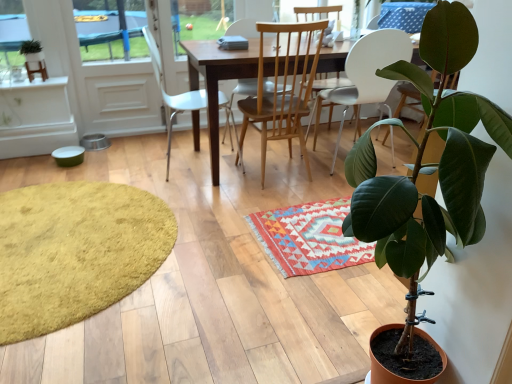
Question: Is white plastic chair at center, acting as the 3th chair starting from the right, positioned beyond the bounds of light wood/wooden chair at center, acting as the 2th chair starting from the left?

Choices:
 (A) yes
 (B) no

Answer: (A)

Question: Can you confirm if white plastic chair at center, acting as the 3th chair starting from the right, is positioned to the left of light wood/wooden chair at center, which is counted as the 2th chair, starting from the right?

Choices:
 (A) yes
 (B) no

Answer: (A)

Question: Considering the relative sizes of white plastic chair at center, acting as the 3th chair starting from the right, and light wood/wooden chair at center, acting as the 2th chair starting from the left, in the image provided, is white plastic chair at center, acting as the 3th chair starting from the right, bigger than light wood/wooden chair at center, acting as the 2th chair starting from the left,?

Choices:
 (A) yes
 (B) no

Answer: (A)

Question: Is white plastic chair at center, placed as the first chair when sorted from left to right, oriented away from light wood/wooden chair at center, acting as the 2th chair starting from the left?

Choices:
 (A) no
 (B) yes

Answer: (A)

Question: Can you confirm if white plastic chair at center, placed as the first chair when sorted from left to right, is smaller than light wood/wooden chair at center, which is counted as the 2th chair, starting from the right?

Choices:
 (A) yes
 (B) no

Answer: (B)

Question: Considering the relative sizes of white plastic chair at center, placed as the first chair when sorted from left to right, and light wood/wooden chair at center, acting as the 2th chair starting from the left, in the image provided, is white plastic chair at center, placed as the first chair when sorted from left to right, wider than light wood/wooden chair at center, acting as the 2th chair starting from the left,?

Choices:
 (A) no
 (B) yes

Answer: (A)

Question: Considering the relative sizes of white glossy screen door at upper left and green matte plant at lower right, which is counted as the 1th houseplant, starting from the right, in the image provided, is white glossy screen door at upper left smaller than green matte plant at lower right, which is counted as the 1th houseplant, starting from the right,?

Choices:
 (A) no
 (B) yes

Answer: (B)

Question: Can you confirm if white glossy screen door at upper left is positioned to the left of green matte plant at lower right, the second houseplant from the back?

Choices:
 (A) yes
 (B) no

Answer: (A)

Question: Can you confirm if white glossy screen door at upper left is shorter than green matte plant at lower right, which is counted as the 1th houseplant, starting from the right?

Choices:
 (A) yes
 (B) no

Answer: (A)

Question: Is white glossy screen door at upper left beside green matte plant at lower right, the second houseplant from the back?

Choices:
 (A) no
 (B) yes

Answer: (A)

Question: From a real-world perspective, is white glossy screen door at upper left below green matte plant at lower right, the second houseplant from the back?

Choices:
 (A) no
 (B) yes

Answer: (B)

Question: Can you confirm if white glossy screen door at upper left is bigger than green matte plant at lower right, positioned as the second houseplant in left-to-right order?

Choices:
 (A) no
 (B) yes

Answer: (A)

Question: Is wooden table at center at the right side of light wood/wooden chair at center, acting as the 2th chair starting from the left?

Choices:
 (A) no
 (B) yes

Answer: (B)